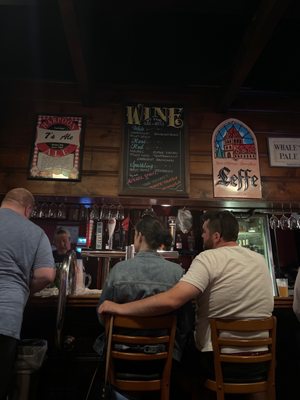
Where is `chair`? Image resolution: width=300 pixels, height=400 pixels. chair is located at coordinates (252, 336), (148, 340).